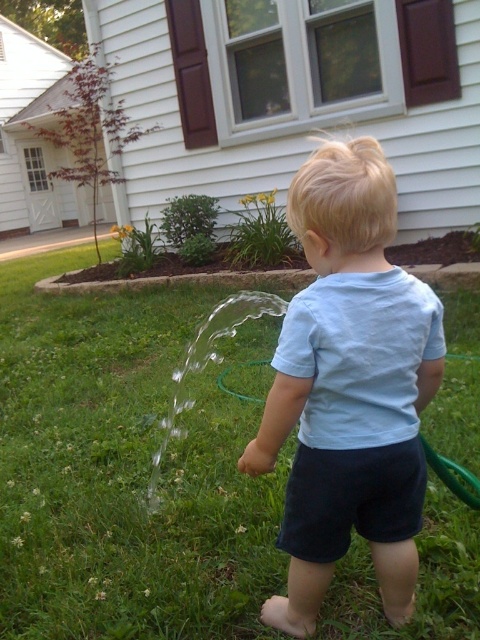
Question: Estimate the real-world distances between objects in this image. Which object is farther from the green rubber hose at lower center?

Choices:
 (A) green grass at center
 (B) light blue cotton shirt at center

Answer: (A)

Question: Does light blue cotton shirt at center come behind green rubber hose at lower center?

Choices:
 (A) no
 (B) yes

Answer: (A)

Question: Can you confirm if green grass at center is smaller than green rubber hose at lower center?

Choices:
 (A) no
 (B) yes

Answer: (A)

Question: In this image, where is green grass at center located relative to light blue cotton shirt at center?

Choices:
 (A) left
 (B) right

Answer: (A)

Question: Which object is the closest to the green rubber hose at lower center?

Choices:
 (A) light blue cotton shirt at center
 (B) green grass at center

Answer: (A)

Question: Which point is farther from the camera taking this photo?

Choices:
 (A) (303, 204)
 (B) (262, 579)

Answer: (B)